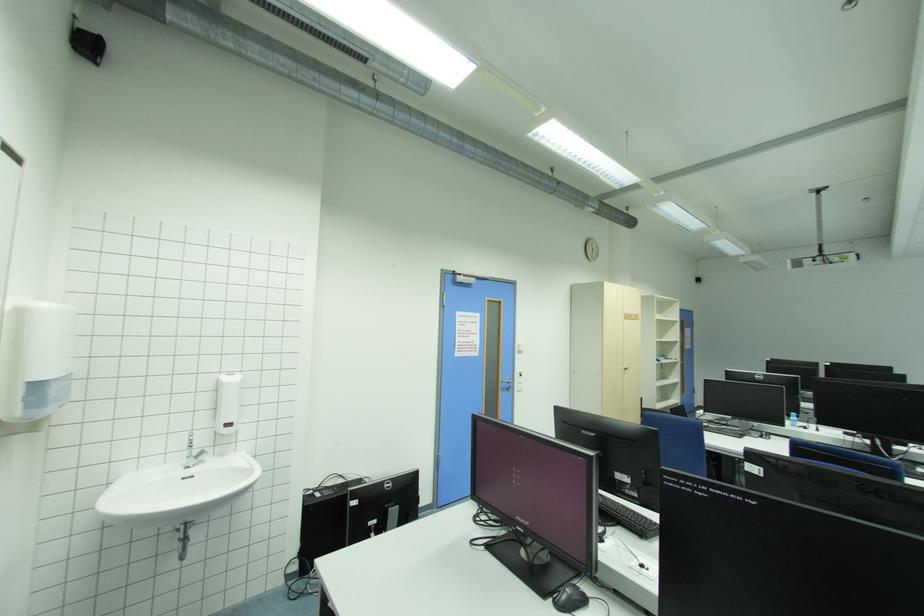
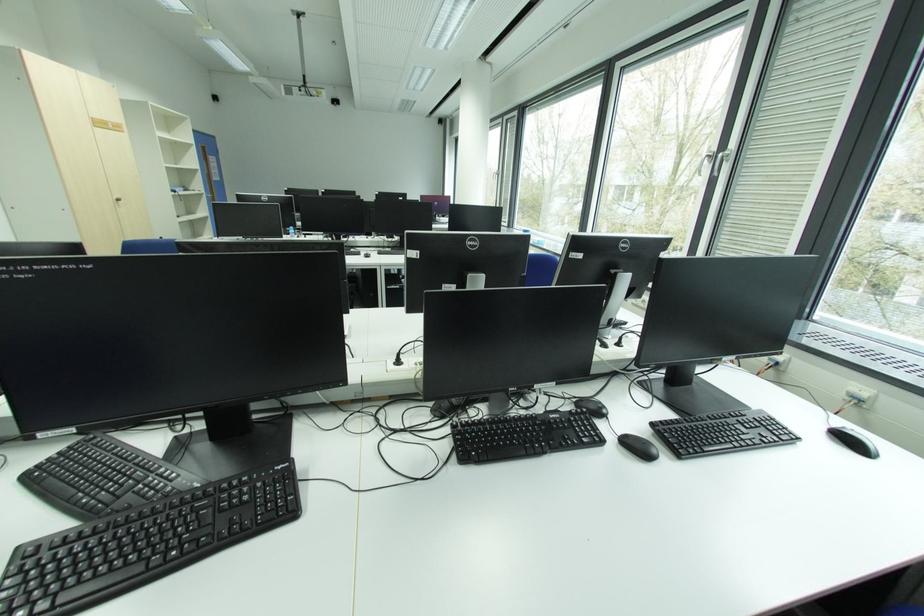
First-person continuous shooting, in which direction is the camera rotating?

The camera rotated toward right-down.